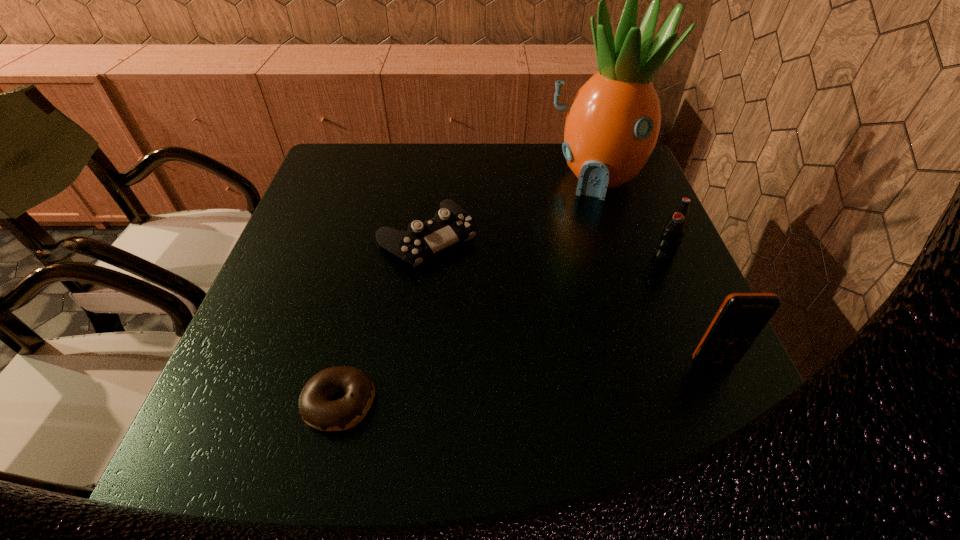
This screenshot has height=540, width=960. Identify the location of free spot located on the front label of the pop. (617, 318).

Where is `free space located 0.400m on the front label of the pop`? free space located 0.400m on the front label of the pop is located at coordinates (567, 383).

Identify the location of vacant area situated 0.190m on the surface of the fourth tallest object. The image size is (960, 540). (510, 318).

Where is `vacant region located 0.230m on the surface of the fourth tallest object`? vacant region located 0.230m on the surface of the fourth tallest object is located at coordinates (523, 330).

The height and width of the screenshot is (540, 960). I want to click on vacant space located 0.080m on the surface of the fourth tallest object, so (x=477, y=286).

Find the location of a particular element. free space located at the entrance of the tallest object is located at coordinates (563, 291).

The width and height of the screenshot is (960, 540). I want to click on free spot located 0.370m at the entrance of the tallest object, so coord(559,305).

Image resolution: width=960 pixels, height=540 pixels. I want to click on free space located at the entrance of the tallest object, so click(557, 312).

Image resolution: width=960 pixels, height=540 pixels. Find the location of `object that is at the far edge`. object that is at the far edge is located at coordinates (612, 125).

At what (x,y) coordinates should I click in order to perform the action: click on object situated at the near edge. Please return your answer as a coordinate pair (x, y). Looking at the image, I should click on (316, 409).